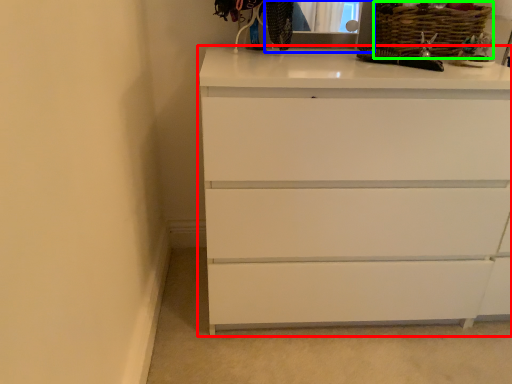
Question: Which object is positioned closest to chest of drawers (highlighted by a red box)? Select from medicine cabinet (highlighted by a blue box) and basket (highlighted by a green box).

Choices:
 (A) medicine cabinet
 (B) basket

Answer: (B)